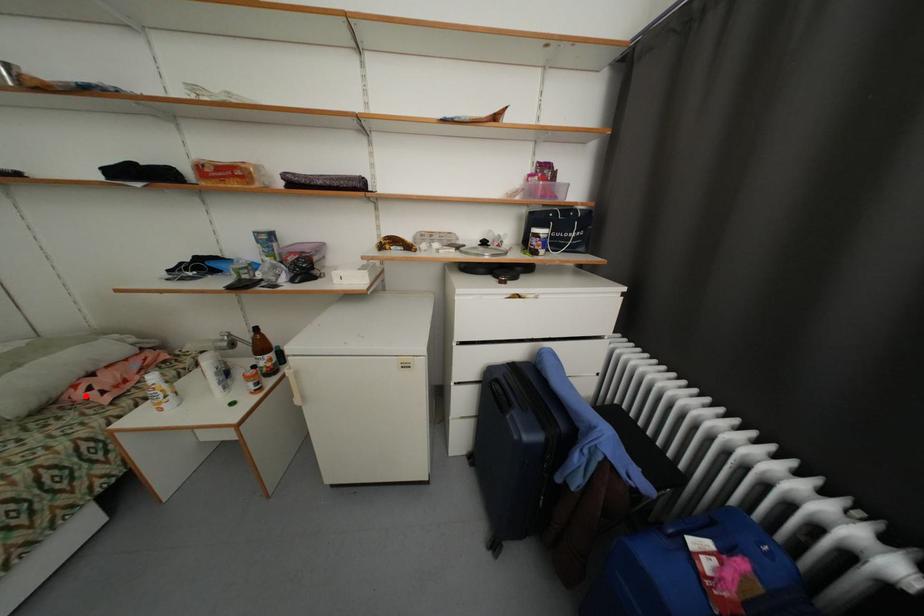
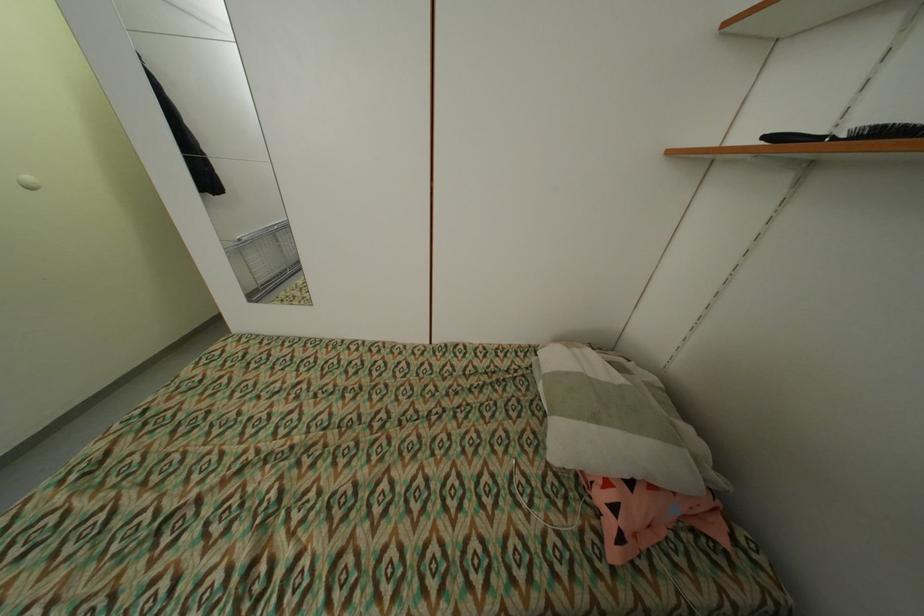
The point at the highlighted location is marked in the first image. Where is the corresponding point in the second image?

(606, 498)